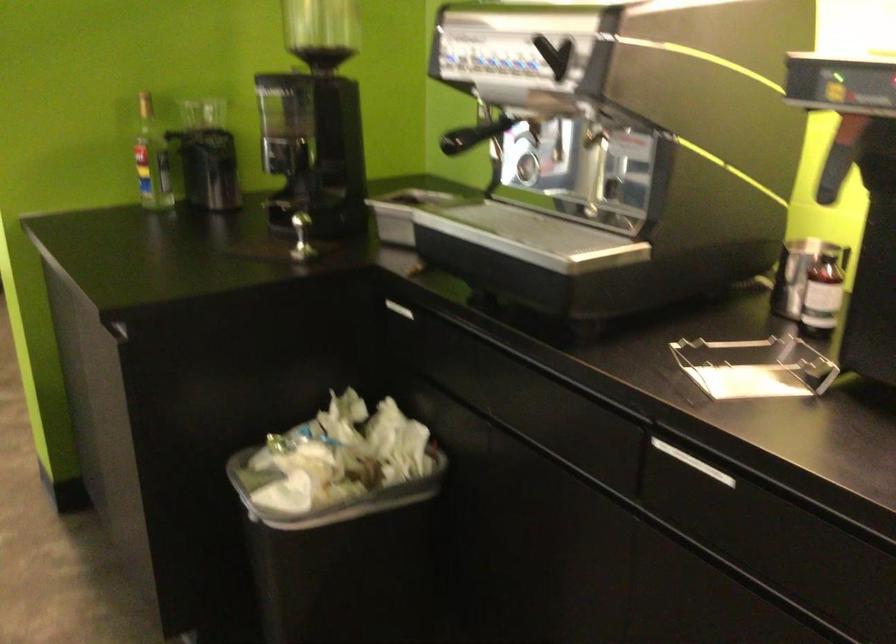
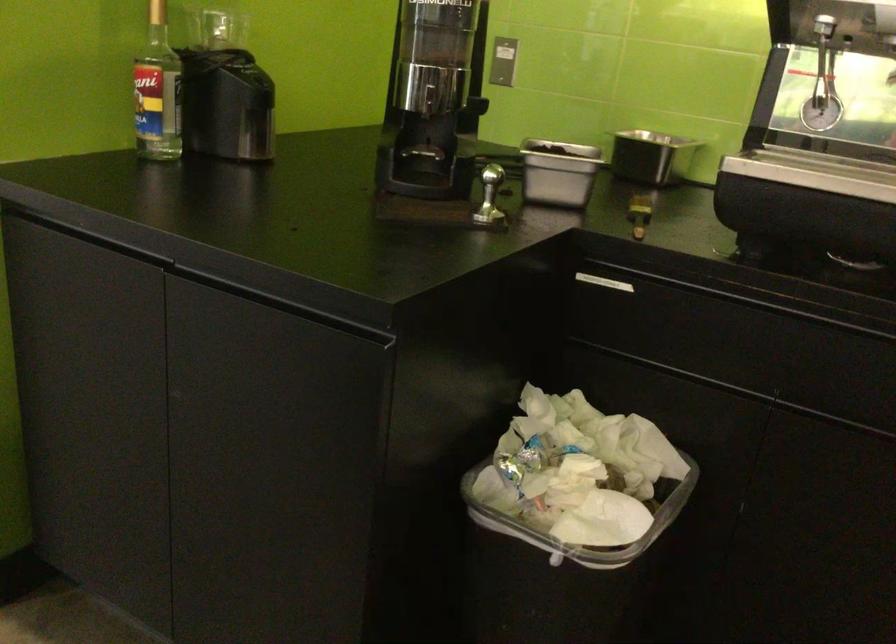
Where in the second image is the point corresponding to point (391, 219) from the first image?

(558, 172)